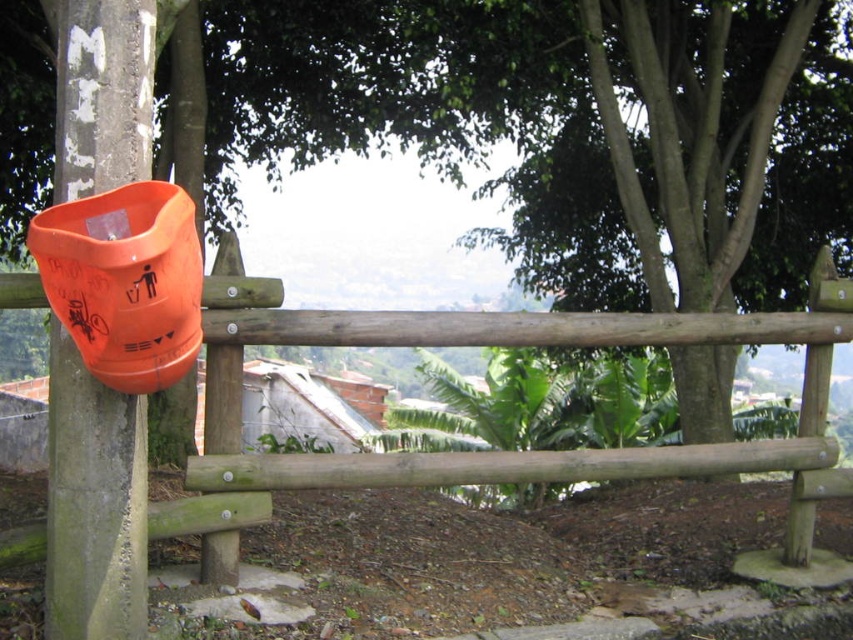
Is wooden fence at center above orange matte plastic trash can at left?

Yes, wooden fence at center is above orange matte plastic trash can at left.

Which is more to the left, wooden fence at center or orange matte plastic trash can at left?

orange matte plastic trash can at left

The width and height of the screenshot is (853, 640). In order to click on wooden fence at center in this screenshot , I will do `click(387, 452)`.